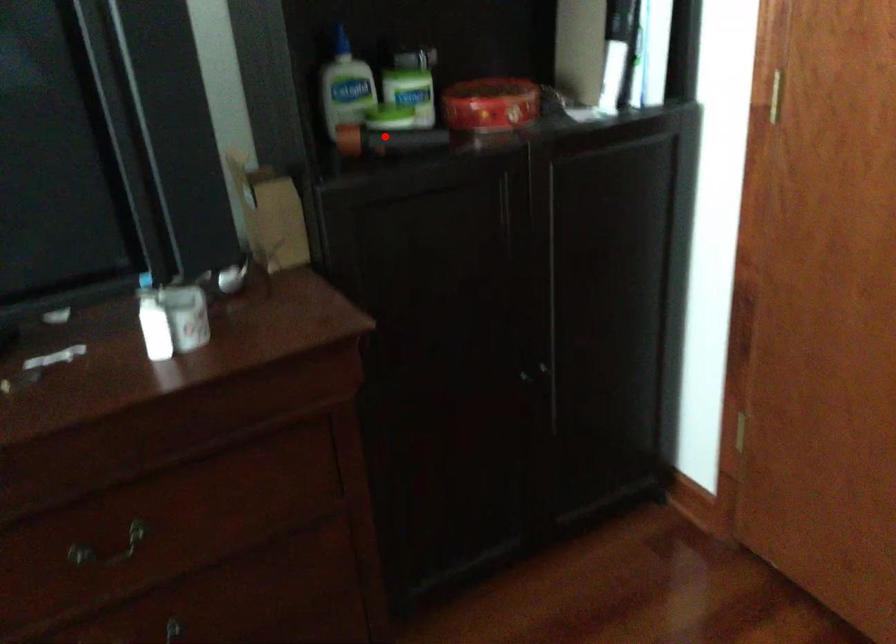
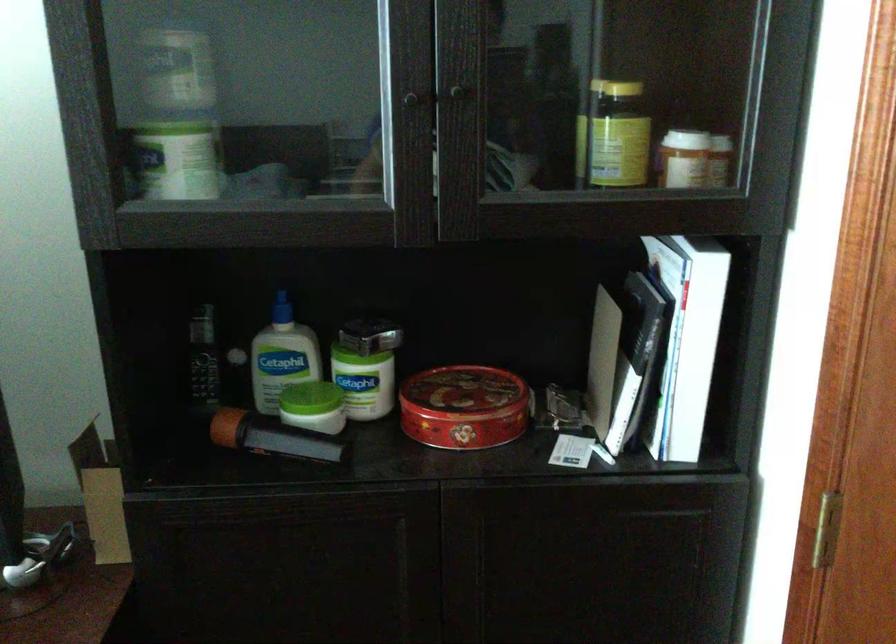
Question: I am providing you with two images of the same scene from different viewpoints. Image1 has a red point marked. In image2, the corresponding 3D location appears at what relative position? Reply with the corresponding letter.

Choices:
 (A) Closer
 (B) Farther

Answer: (A)